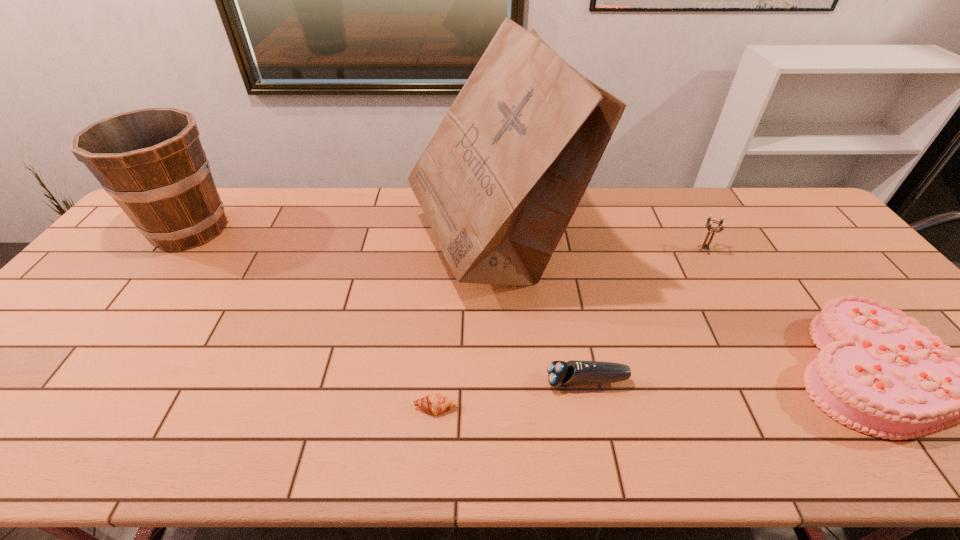
Where is `vacant space that satisfies the following two spatial constraints: 1. on the front side of the fifth object from left to right; 2. on the head of the electric shaver`? Image resolution: width=960 pixels, height=540 pixels. vacant space that satisfies the following two spatial constraints: 1. on the front side of the fifth object from left to right; 2. on the head of the electric shaver is located at coordinates (x=777, y=381).

Where is `vacant space that satisfies the following two spatial constraints: 1. on the head of the fifth tallest object; 2. on the front-facing side of the shortest object`? vacant space that satisfies the following two spatial constraints: 1. on the head of the fifth tallest object; 2. on the front-facing side of the shortest object is located at coordinates (592, 408).